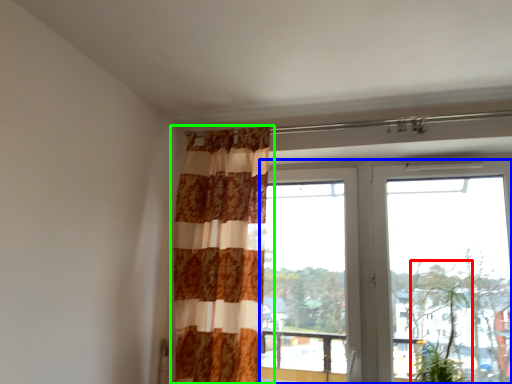
Question: Which object is the closest to the plant (highlighted by a red box)? Choose among these: window (highlighted by a blue box) or curtain (highlighted by a green box).

Choices:
 (A) window
 (B) curtain

Answer: (A)